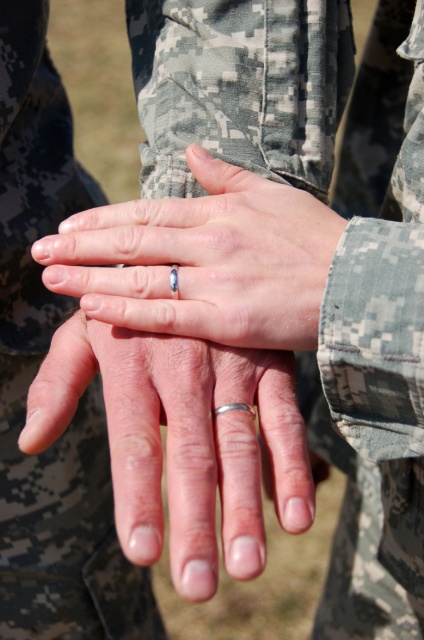
What is the exact coordinate of the digital camouflage uniform at center?

The digital camouflage uniform at center is located at point (35, 372).

You are a photographer trying to capture a close up of the silver metallic ring at center without the digital camouflage uniform at center blocking it. Based on the scene, can you tell me if the ring will be visible in the photo?

The digital camouflage uniform at center is much taller than the silver metallic ring at center, so the uniform will block the ring in the photo.

You are a photographer trying to capture a closeup of the point at coordinates point (39, 92). The camera is currently 36.26 inches away from the point. If you want to get a closer shot, should you move the camera closer or farther away?

To get a closer shot of the point at coordinates point (39, 92), you should move the camera closer to the point since it is currently 36.26 inches away.